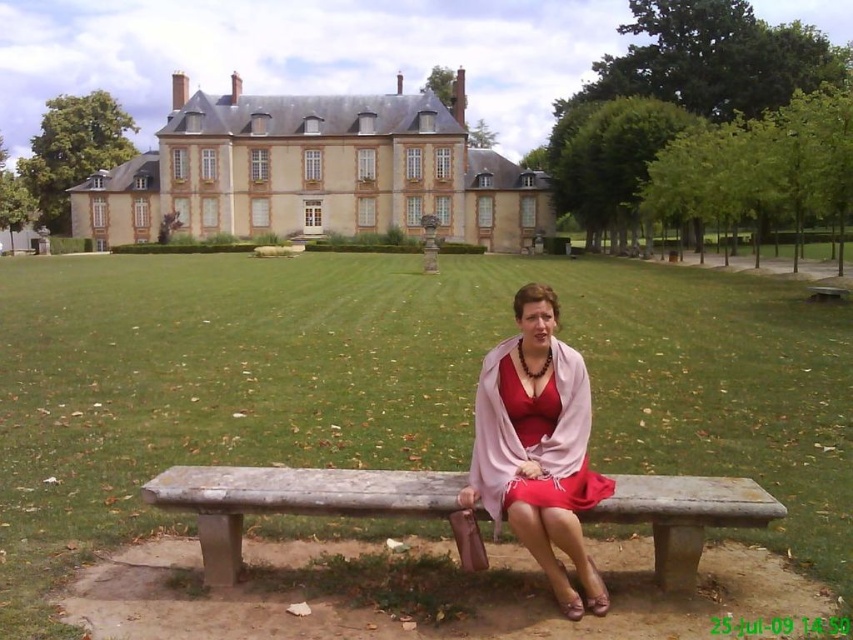
Does point (703, 480) lie in front of point (485, 401)?

That is True.

Describe the element at coordinates (291, 500) in the screenshot. I see `stone bench at center` at that location.

Where is `stone bench at center`? The width and height of the screenshot is (853, 640). stone bench at center is located at coordinates tap(291, 500).

Which is in front, point (178, 157) or point (549, 522)?

Point (549, 522)

Who is more distant from viewer, (311, 138) or (579, 429)?

The point (311, 138) is behind.

In order to click on beige stone palace at upper center in this screenshot , I will do `click(314, 172)`.

Does beige stone palace at upper center have a greater width compared to stone bench at center?

Yes.

Does point (393, 100) lie in front of point (244, 500)?

No, (393, 100) is further to viewer.

Who is more forward, (347, 196) or (331, 476)?

Point (331, 476) is more forward.

Image resolution: width=853 pixels, height=640 pixels. I want to click on beige stone palace at upper center, so click(x=314, y=172).